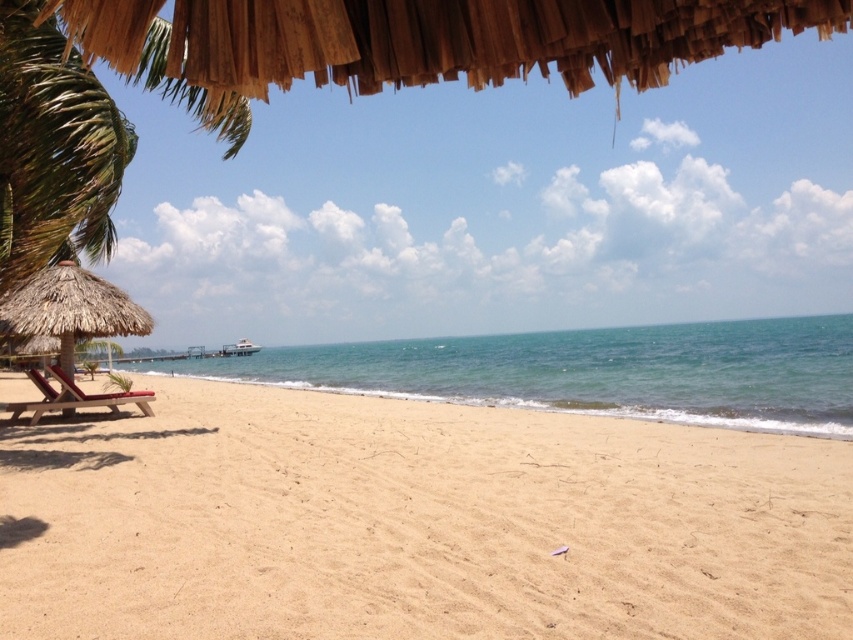
Question: Can you confirm if light beige sand at center is positioned to the right of matte brown lounge chair at lower left?

Choices:
 (A) yes
 (B) no

Answer: (A)

Question: In this image, where is light beige sand at center located relative to thatched straw umbrella at left?

Choices:
 (A) above
 (B) below

Answer: (B)

Question: Which point is farther to the camera?

Choices:
 (A) matte brown lounge chair at lower left
 (B) thatched straw umbrella at left

Answer: (A)

Question: Which of the following is the farthest from the observer?

Choices:
 (A) matte brown lounge chair at lower left
 (B) light beige sand at center
 (C) thatched straw umbrella at left
 (D) green leafy palm tree at left

Answer: (D)

Question: Which of the following is the farthest from the observer?

Choices:
 (A) matte brown lounge chair at lower left
 (B) green leafy palm tree at left
 (C) light beige sand at center

Answer: (B)

Question: Is light beige sand at center positioned before matte brown lounge chair at lower left?

Choices:
 (A) no
 (B) yes

Answer: (B)